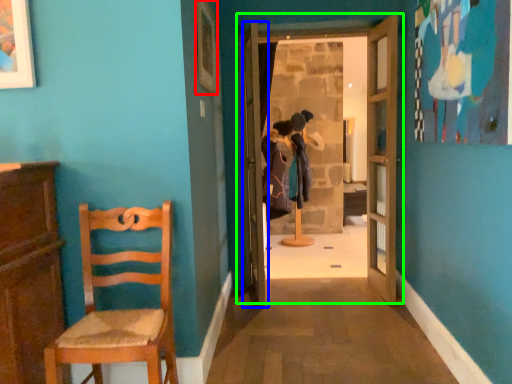
Question: Which object is the closest to the picture frame (highlighted by a red box)? Choose among these: door (highlighted by a blue box) or door (highlighted by a green box).

Choices:
 (A) door
 (B) door

Answer: (B)